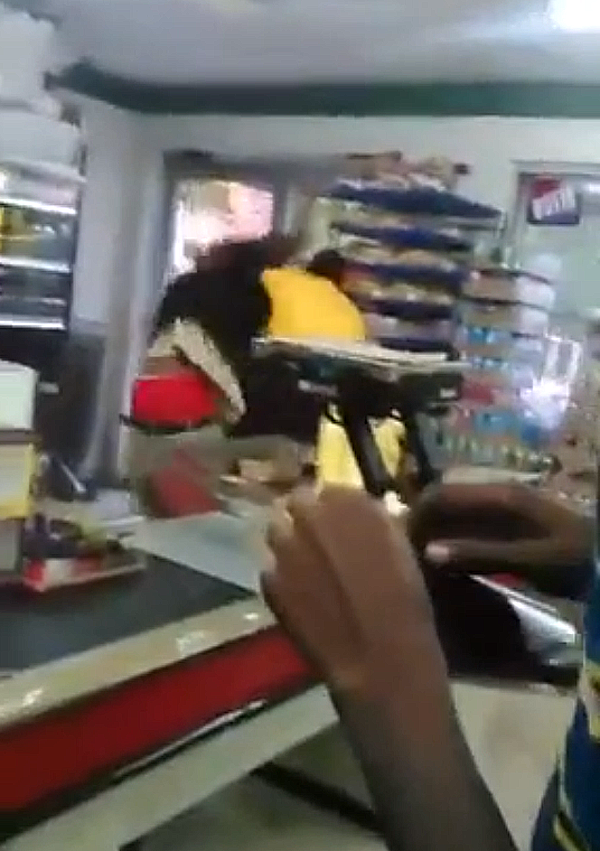
The width and height of the screenshot is (600, 851). I want to click on red blue and white poster on glass, so click(x=570, y=209).